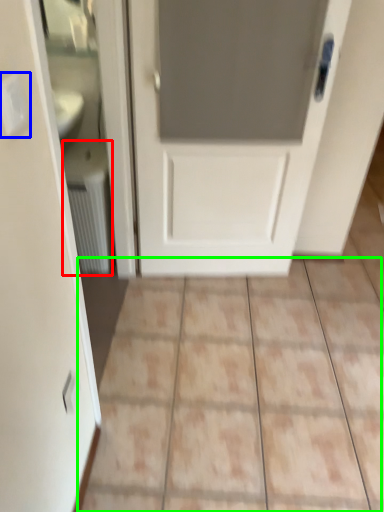
Question: Estimate the real-world distances between objects in this image. Which object is closer to radiator (highlighted by a red box), electric outlet (highlighted by a blue box) or ceramic tile (highlighted by a green box)?

Choices:
 (A) electric outlet
 (B) ceramic tile

Answer: (B)